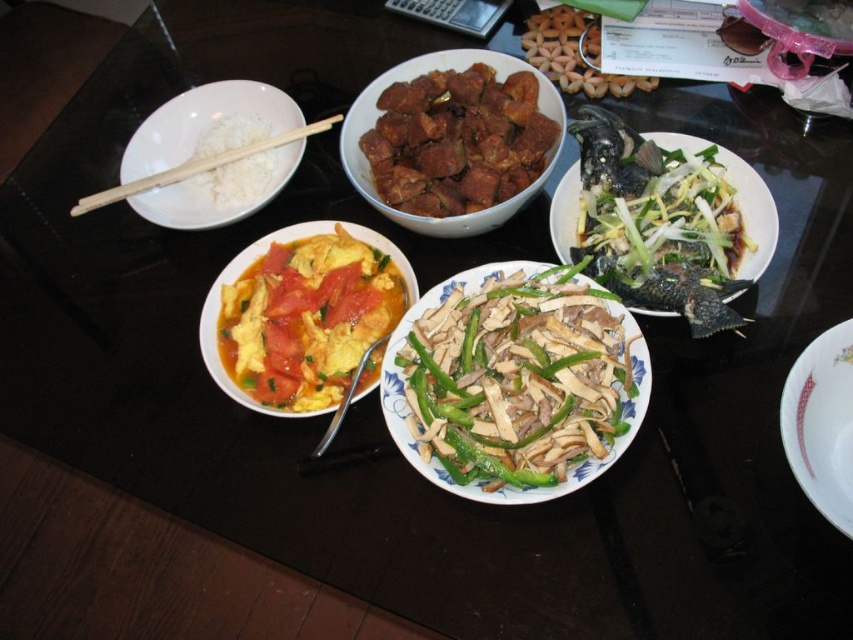
Question: Can you confirm if green matte vegetables at center is thinner than tomato-based omelette at center?

Choices:
 (A) no
 (B) yes

Answer: (A)

Question: Which point is farther to the camera?

Choices:
 (A) white matte rice at upper left
 (B) tomato-based omelette at center

Answer: (A)

Question: In this image, where is white matte rice at upper left located relative to white wood chopsticks at upper left?

Choices:
 (A) below
 (B) above

Answer: (A)

Question: Which point is farther from the camera taking this photo?

Choices:
 (A) (218, 176)
 (B) (567, 252)
 (C) (341, 372)

Answer: (A)

Question: Which point appears farthest from the camera in this image?

Choices:
 (A) (260, 150)
 (B) (248, 124)

Answer: (B)

Question: Is white matte rice at upper left wider than white wood chopsticks at upper left?

Choices:
 (A) yes
 (B) no

Answer: (B)